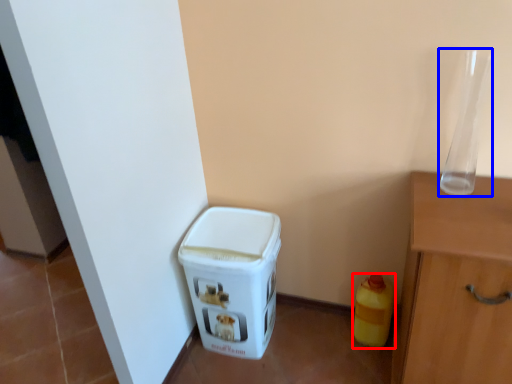
Question: Among these objects, which one is nearest to the camera, bottle (highlighted by a red box) or glass vase (highlighted by a blue box)?

Choices:
 (A) bottle
 (B) glass vase

Answer: (B)